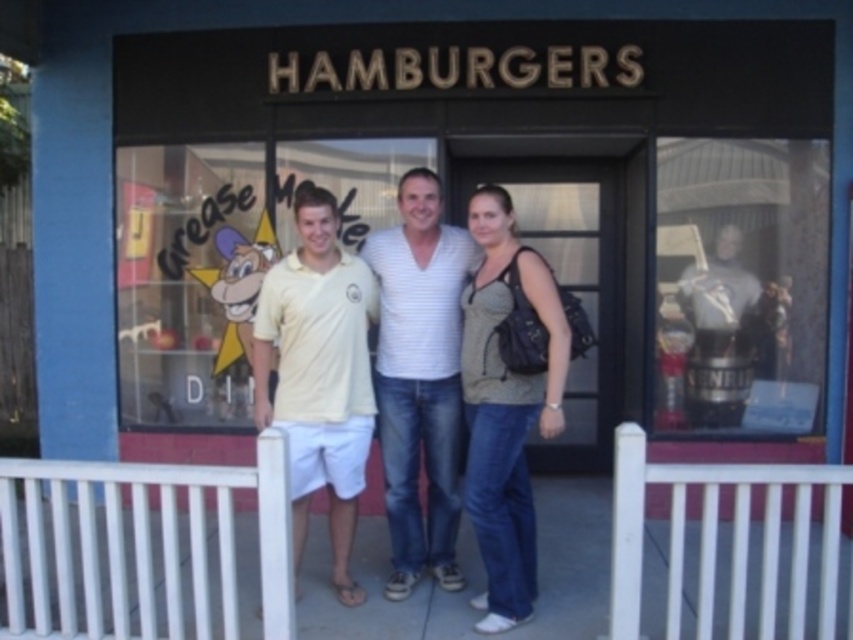
Question: Which point is farther to the camera?

Choices:
 (A) yellow cotton polo shirt at center
 (B) light yellow cotton shirt at center
 (C) matte gray tank top at center
 (D) white striped shirt at center

Answer: (B)

Question: Among these objects, which one is nearest to the camera?

Choices:
 (A) white striped shirt at center
 (B) light yellow cotton shirt at center
 (C) yellow cotton polo shirt at center

Answer: (C)

Question: Which object is farther from the camera taking this photo?

Choices:
 (A) matte gray tank top at center
 (B) white striped shirt at center
 (C) white wooden fence at center
 (D) yellow cotton polo shirt at center

Answer: (B)

Question: Considering the relative positions of white striped shirt at center and yellow cotton polo shirt at center in the image provided, where is white striped shirt at center located with respect to yellow cotton polo shirt at center?

Choices:
 (A) above
 (B) below

Answer: (A)

Question: Does light yellow cotton shirt at center appear under matte gray tank top at center?

Choices:
 (A) no
 (B) yes

Answer: (A)

Question: Considering the relative positions of yellow cotton polo shirt at center and matte gray tank top at center in the image provided, where is yellow cotton polo shirt at center located with respect to matte gray tank top at center?

Choices:
 (A) left
 (B) right

Answer: (A)